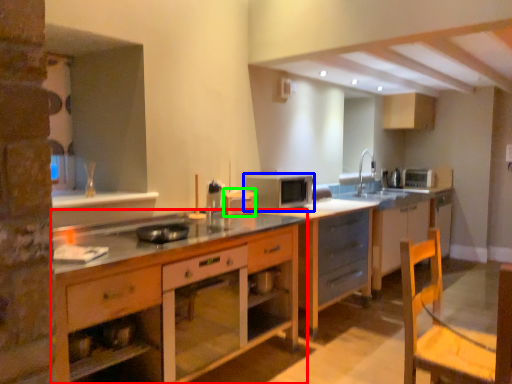
Question: Which object is the closest to the cabinetry (highlighted by a red box)? Choose among these: microwave oven (highlighted by a blue box) or appliance (highlighted by a green box).

Choices:
 (A) microwave oven
 (B) appliance

Answer: (B)